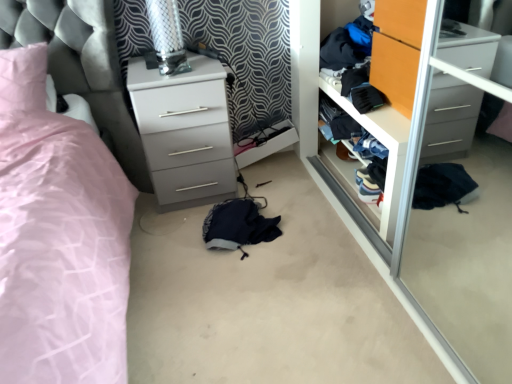
I want to click on spots to the right of navy blue fabric at center, so click(x=315, y=225).